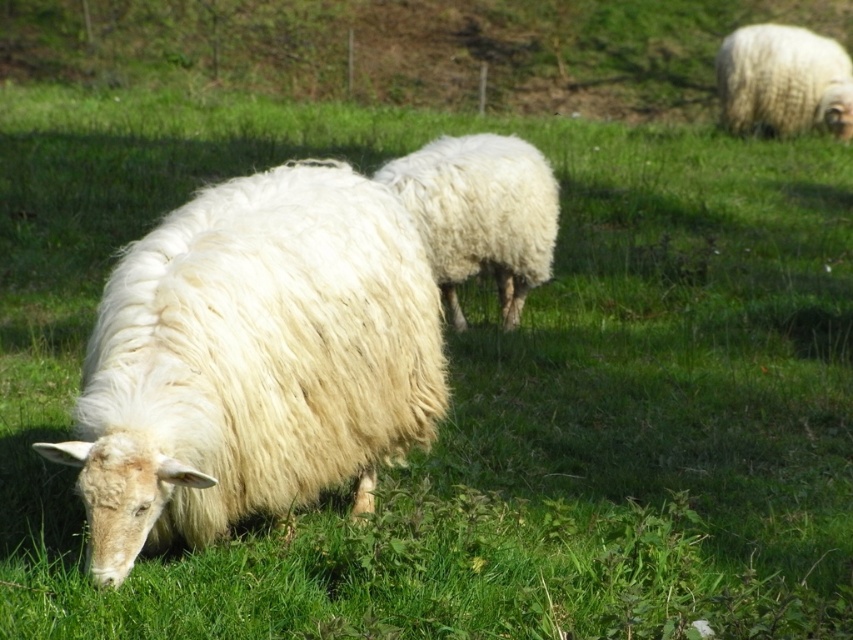
You are a photographer trying to capture the white fluffy sheep at center and the white fluffy wool at center in the same frame. Based on their positions, which one will appear closer to the camera in the photo?

The white fluffy sheep at center is positioned under the white fluffy wool at center, so the white fluffy wool at center will appear closer to the camera in the photo.